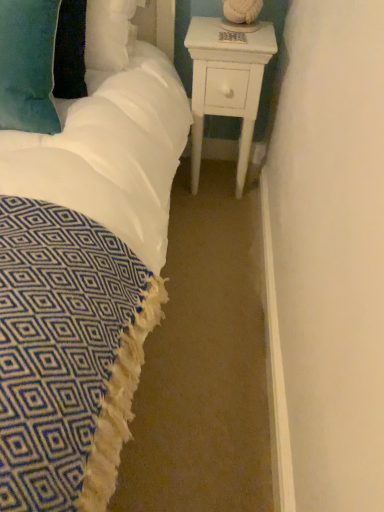
Where is `free location above white wood nightstand at right (from a real-world perspective)`? The image size is (384, 512). free location above white wood nightstand at right (from a real-world perspective) is located at coordinates (233, 33).